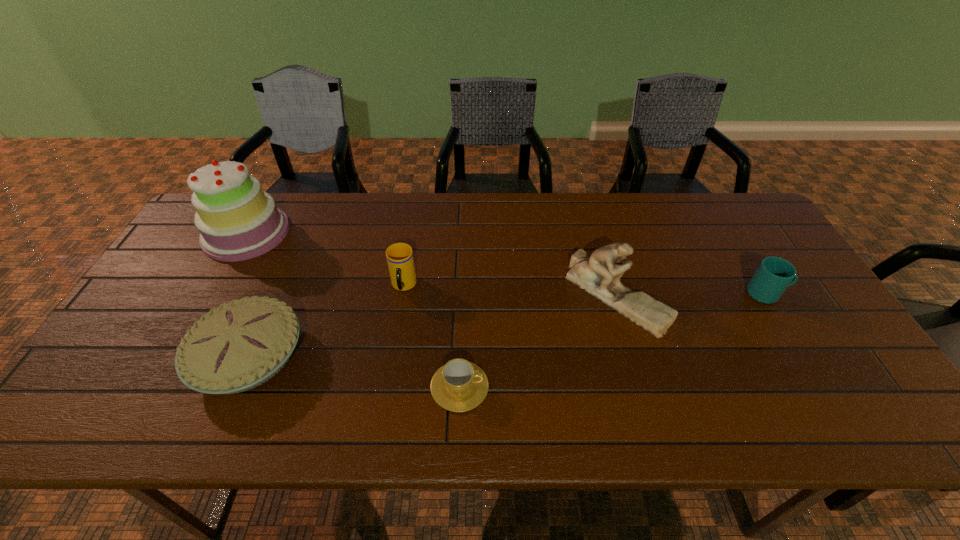
Find the location of a particular element. This screenshot has width=960, height=540. object that is at the far left corner is located at coordinates (237, 220).

Identify the location of vacant space at the far edge. This screenshot has height=540, width=960. (479, 219).

Where is `vacant space at the near edge of the desktop`? vacant space at the near edge of the desktop is located at coordinates (307, 427).

The image size is (960, 540). In the image, there is a desktop. In order to click on vacant space at the left edge in this screenshot , I will do `click(113, 375)`.

Identify the location of vacant position at the far right corner of the desktop. (708, 193).

Identify the location of unoccupied area between the rightmost cup and the tallest object. The width and height of the screenshot is (960, 540). (507, 263).

Identify the location of unoccupied position between the fourth object from right to left and the pie. The width and height of the screenshot is (960, 540). (326, 321).

Image resolution: width=960 pixels, height=540 pixels. I want to click on free point between the nearest cup and the cake, so click(x=353, y=309).

Image resolution: width=960 pixels, height=540 pixels. What are the coordinates of `free space between the second cup from right to left and the rightmost cup` in the screenshot? It's located at pos(613,340).

Find the location of `unoccupied area between the fourth object from right to left and the second object from right to left`. unoccupied area between the fourth object from right to left and the second object from right to left is located at coordinates (510, 291).